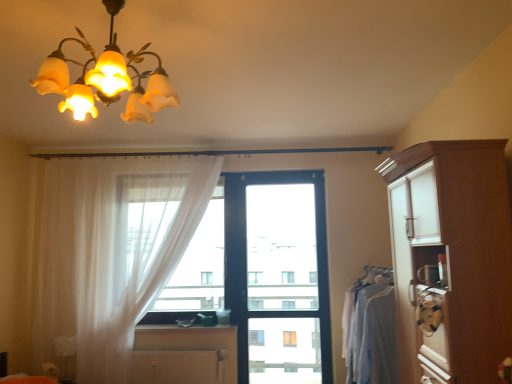
Question: Is translucent fabric at center far from brown wood cabinet at right, the 1th cabinetry when ordered from top to bottom?

Choices:
 (A) yes
 (B) no

Answer: (A)

Question: From the image's perspective, is translucent fabric at center below brown wood cabinet at right, placed as the first cabinetry when sorted from front to back?

Choices:
 (A) yes
 (B) no

Answer: (A)

Question: Is translucent fabric at center aimed at brown wood cabinet at right, placed as the first cabinetry when sorted from front to back?

Choices:
 (A) yes
 (B) no

Answer: (B)

Question: Is translucent fabric at center to the right of brown wood cabinet at right, placed as the first cabinetry when sorted from front to back, from the viewer's perspective?

Choices:
 (A) yes
 (B) no

Answer: (B)

Question: Can you see translucent fabric at center touching brown wood cabinet at right, the second cabinetry in the back-to-front sequence?

Choices:
 (A) yes
 (B) no

Answer: (B)

Question: Is translucent fabric at center to the left of brown wood cabinet at right, which ranks as the 2th cabinetry in bottom-to-top order, from the viewer's perspective?

Choices:
 (A) no
 (B) yes

Answer: (B)

Question: Is translucent fabric at center looking in the opposite direction of black plastic window at center?

Choices:
 (A) yes
 (B) no

Answer: (B)

Question: Is the depth of translucent fabric at center greater than that of black plastic window at center?

Choices:
 (A) yes
 (B) no

Answer: (A)

Question: Is translucent fabric at center oriented towards black plastic window at center?

Choices:
 (A) yes
 (B) no

Answer: (B)

Question: From a real-world perspective, is translucent fabric at center located beneath black plastic window at center?

Choices:
 (A) yes
 (B) no

Answer: (B)

Question: Is translucent fabric at center to the right of black plastic window at center from the viewer's perspective?

Choices:
 (A) no
 (B) yes

Answer: (A)

Question: Can you confirm if translucent fabric at center is thinner than black plastic window at center?

Choices:
 (A) no
 (B) yes

Answer: (A)

Question: From a real-world perspective, is smooth wooden counter top at center over black plastic window at center?

Choices:
 (A) no
 (B) yes

Answer: (A)